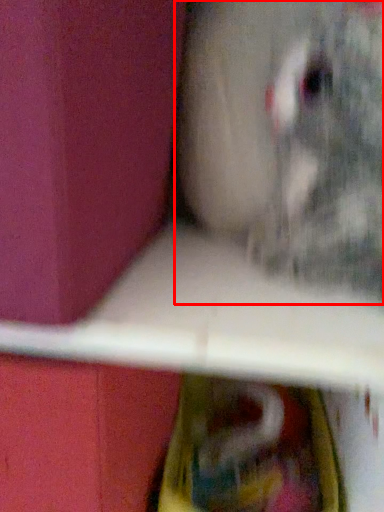
Question: From the image's perspective, what is the correct spatial positioning of animal (annotated by the red box) in reference to box?

Choices:
 (A) below
 (B) above

Answer: (A)